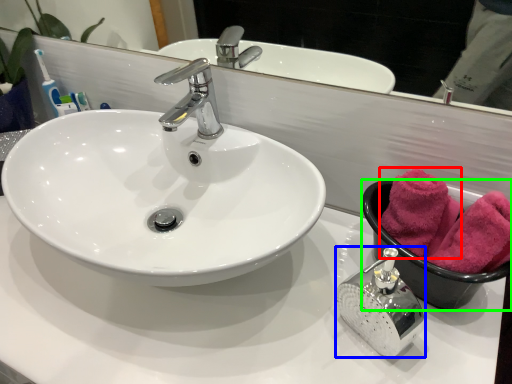
Question: Considering the real-world distances, which object is farthest from bath towel (highlighted by a red box)? soap dispenser (highlighted by a blue box) or basin (highlighted by a green box)?

Choices:
 (A) soap dispenser
 (B) basin

Answer: (A)